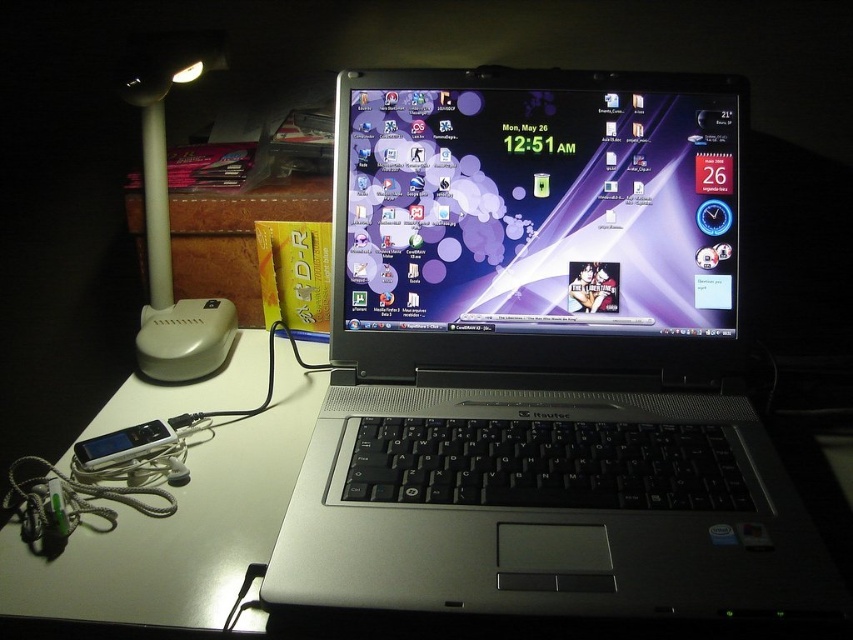
Can you confirm if silver/black plastic laptop at center is positioned above satin silver ipod at lower left?

Correct, silver/black plastic laptop at center is located above satin silver ipod at lower left.

Can you confirm if silver/black plastic laptop at center is smaller than satin silver ipod at lower left?

No.

Where is `silver/black plastic laptop at center`? This screenshot has width=853, height=640. silver/black plastic laptop at center is located at coordinates 541,358.

Can you confirm if white glossy table at center is smaller than satin silver ipod at lower left?

Incorrect, white glossy table at center is not smaller in size than satin silver ipod at lower left.

Between white glossy table at center and satin silver ipod at lower left, which one appears on the left side from the viewer's perspective?

satin silver ipod at lower left is more to the left.

Between point (128, 600) and point (126, 435), which one is positioned in front?

Positioned in front is point (128, 600).

Find the location of a particular element. The image size is (853, 640). white glossy table at center is located at coordinates (199, 592).

Who is positioned more to the left, white plastic table lamp at upper left or satin silver ipod at lower left?

white plastic table lamp at upper left

Is white plastic table lamp at upper left to the right of satin silver ipod at lower left from the viewer's perspective?

In fact, white plastic table lamp at upper left is to the left of satin silver ipod at lower left.

Between point (165, 244) and point (115, 435), which one is positioned in front?

Point (115, 435) is in front.

Locate an element on the screen. The width and height of the screenshot is (853, 640). white plastic table lamp at upper left is located at coordinates (161, 131).